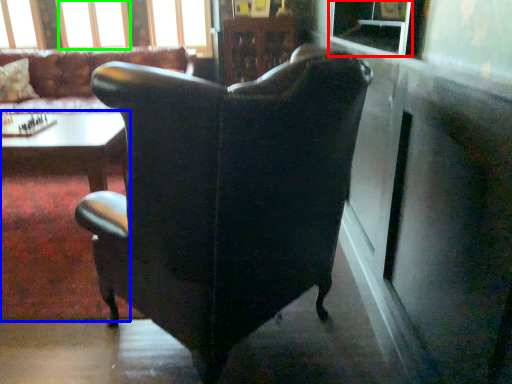
Question: Which object is the farthest from window screen (highlighted by a red box)? Choose among these: table (highlighted by a blue box) or window (highlighted by a green box).

Choices:
 (A) table
 (B) window

Answer: (B)